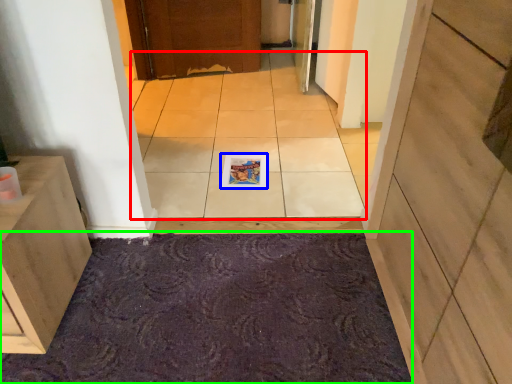
Question: Considering the real-world distances, which object is farthest from ceramic tile (highlighted by a red box)? magazine (highlighted by a blue box) or bath mat (highlighted by a green box)?

Choices:
 (A) magazine
 (B) bath mat

Answer: (B)